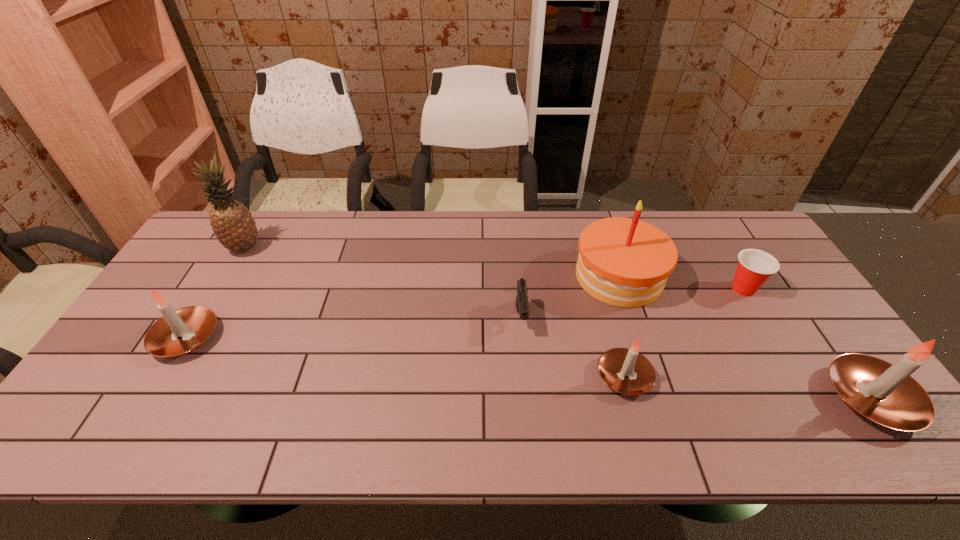
Where is `candle that is the closest to the fourth shortest object`? This screenshot has width=960, height=540. candle that is the closest to the fourth shortest object is located at coordinates (626, 371).

This screenshot has width=960, height=540. In order to click on the second closest candle to the sixth shortest object in this screenshot , I will do `click(884, 393)`.

Find the location of `vacant space that satisfies the following two spatial constraints: 1. on the front side of the fifth tallest object; 2. on the left side of the fourth tallest object`. vacant space that satisfies the following two spatial constraints: 1. on the front side of the fifth tallest object; 2. on the left side of the fourth tallest object is located at coordinates (163, 376).

The image size is (960, 540). I want to click on free location that satisfies the following two spatial constraints: 1. at the barrel of the third object from left to right; 2. on the left side of the tallest candle, so click(529, 399).

Locate an element on the screen. vacant space that satisfies the following two spatial constraints: 1. on the front side of the third tallest object; 2. on the right side of the cup is located at coordinates (809, 399).

Find the location of `vacant space that satisfies the following two spatial constraints: 1. on the front side of the birthday cake; 2. on the right side of the pineapple`. vacant space that satisfies the following two spatial constraints: 1. on the front side of the birthday cake; 2. on the right side of the pineapple is located at coordinates (228, 276).

Where is `vacant space that satisfies the following two spatial constraints: 1. on the front side of the shortest candle; 2. on the left side of the pineapple`? vacant space that satisfies the following two spatial constraints: 1. on the front side of the shortest candle; 2. on the left side of the pineapple is located at coordinates (168, 376).